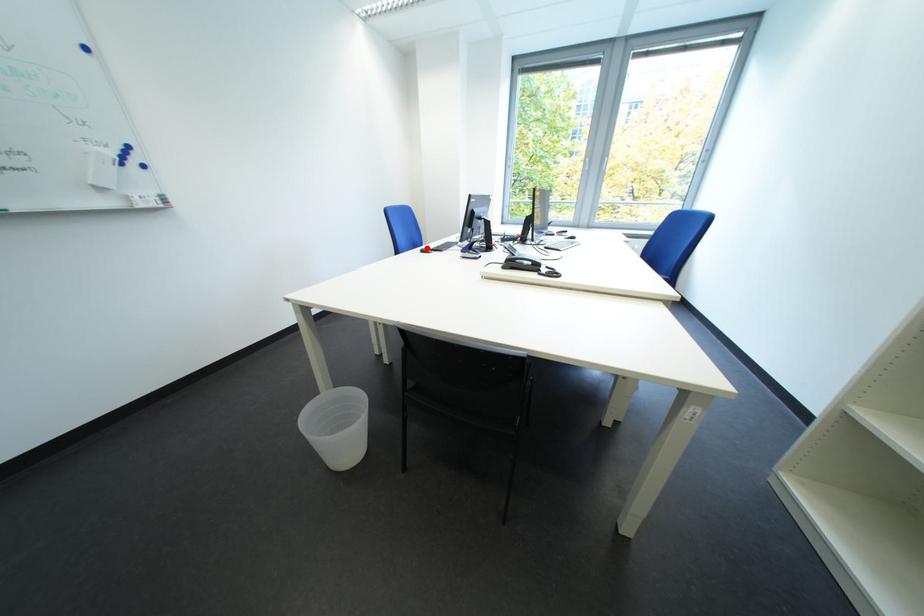
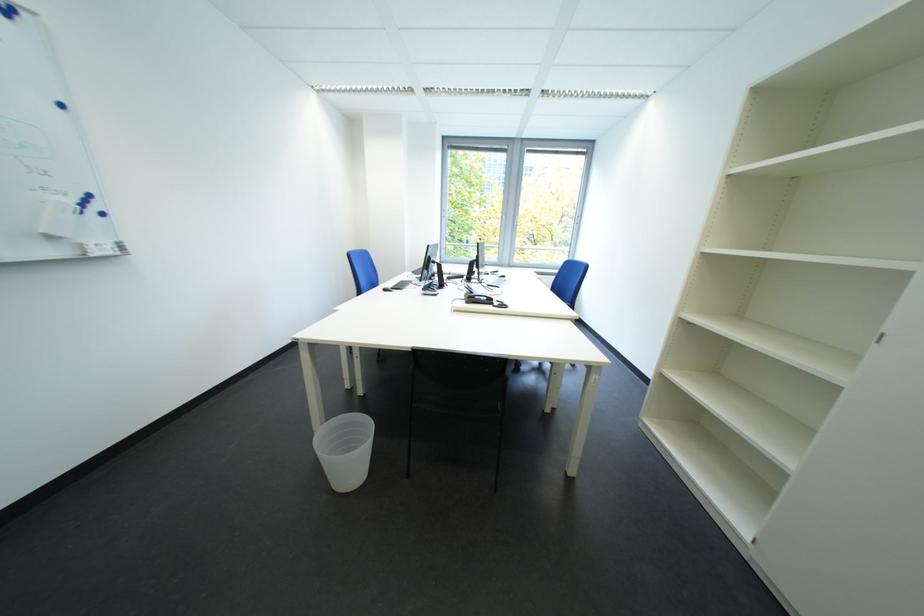
In the second image, find the point that corresponds to the highlighted location in the first image.

(385, 286)